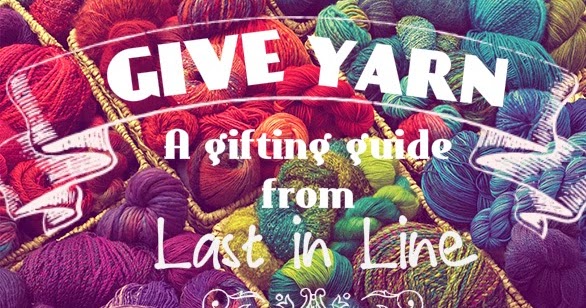
You are a GUI agent. You are given a task and a screenshot of the screen. Output one action in this format:
    pyautogui.click(x=<x>, y=<y>)
    Task: Click on the multi-colored yarn
    This screenshot has width=586, height=308.
    Given the screenshot: What is the action you would take?
    pyautogui.click(x=423, y=290)